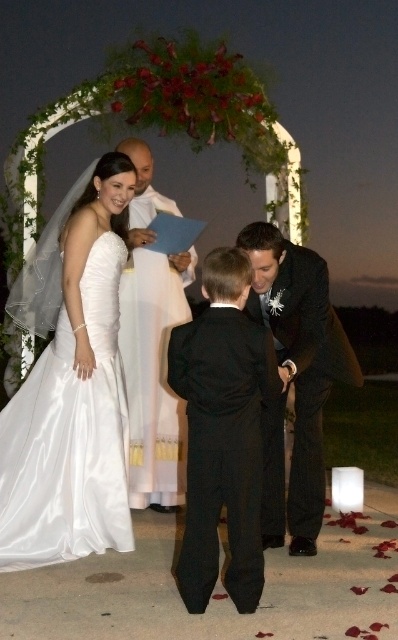
Question: Which of the following is the farthest from the observer?

Choices:
 (A) white satin robe at center
 (B) shiny black suit at center

Answer: (A)

Question: Considering the relative positions of satin white dress at center and white satin robe at center in the image provided, where is satin white dress at center located with respect to white satin robe at center?

Choices:
 (A) below
 (B) above

Answer: (A)

Question: Considering the relative positions of satin white dress at center and white satin robe at center in the image provided, where is satin white dress at center located with respect to white satin robe at center?

Choices:
 (A) below
 (B) above

Answer: (A)

Question: Estimate the real-world distances between objects in this image. Which object is farther from the black satin suit at center?

Choices:
 (A) white satin robe at center
 (B) shiny black suit at center

Answer: (A)

Question: Which object is farther from the camera taking this photo?

Choices:
 (A) white satin robe at center
 (B) shiny black suit at center
 (C) satin white dress at center
 (D) black satin suit at center

Answer: (A)

Question: In this image, where is black satin suit at center located relative to white satin robe at center?

Choices:
 (A) right
 (B) left

Answer: (A)